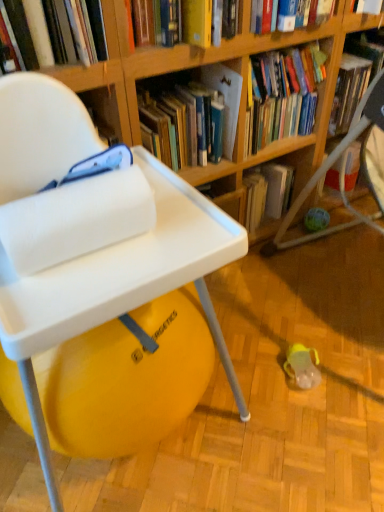
Question: From a real-world perspective, is wooden bookshelf at upper center, the 2th shelf when ordered from right to left, on top of hardcover book at upper center, the second book from the left?

Choices:
 (A) yes
 (B) no

Answer: (A)

Question: Does wooden bookshelf at upper center, the 1th shelf positioned from the front, have a smaller size compared to hardcover book at upper center, marked as the 2th book in a right-to-left arrangement?

Choices:
 (A) no
 (B) yes

Answer: (B)

Question: Considering the relative positions of wooden bookshelf at upper center, the 2th shelf when ordered from right to left, and hardcover book at upper center, marked as the 2th book in a right-to-left arrangement, in the image provided, is wooden bookshelf at upper center, the 2th shelf when ordered from right to left, behind hardcover book at upper center, marked as the 2th book in a right-to-left arrangement,?

Choices:
 (A) no
 (B) yes

Answer: (A)

Question: Does wooden bookshelf at upper center, the 2th shelf when ordered from right to left, appear on the right side of hardcover book at upper center, marked as the 2th book in a right-to-left arrangement?

Choices:
 (A) yes
 (B) no

Answer: (B)

Question: Is wooden bookshelf at upper center, the first shelf viewed from the left, shorter than hardcover book at upper center, the second book from the left?

Choices:
 (A) no
 (B) yes

Answer: (B)

Question: Is wooden bookshelf at upper center, positioned as the 2th shelf in back-to-front order, outside of hardcover book at upper center, the second book from the left?

Choices:
 (A) yes
 (B) no

Answer: (A)

Question: Does hardcover book at upper center, arranged as the third book when viewed from the left, have a lesser height compared to white plastic chair at left?

Choices:
 (A) yes
 (B) no

Answer: (A)

Question: Is hardcover book at upper center, arranged as the first book when viewed from the right, at the left side of white plastic chair at left?

Choices:
 (A) no
 (B) yes

Answer: (A)

Question: Does hardcover book at upper center, arranged as the third book when viewed from the left, come behind white plastic chair at left?

Choices:
 (A) no
 (B) yes

Answer: (B)

Question: From a real-world perspective, is hardcover book at upper center, arranged as the third book when viewed from the left, physically below white plastic chair at left?

Choices:
 (A) no
 (B) yes

Answer: (A)

Question: From a real-world perspective, is hardcover book at upper center, arranged as the first book when viewed from the right, positioned over white plastic chair at left based on gravity?

Choices:
 (A) yes
 (B) no

Answer: (A)

Question: From the image's perspective, is hardcover book at upper center, arranged as the first book when viewed from the right, under white plastic chair at left?

Choices:
 (A) no
 (B) yes

Answer: (A)

Question: Would you consider wooden bookshelf at upper center, the first shelf viewed from the left, to be distant from wooden bookshelf at center, positioned as the first shelf in right-to-left order?

Choices:
 (A) yes
 (B) no

Answer: (B)